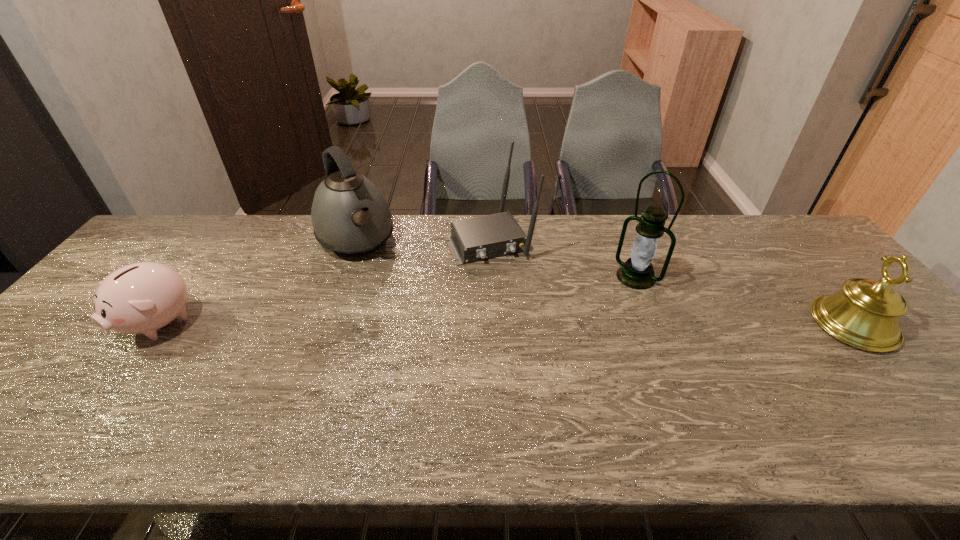
This screenshot has width=960, height=540. I want to click on vacant area between the fourth object from right to left and the router, so click(422, 241).

Locate an element on the screen. The height and width of the screenshot is (540, 960). vacant space that's between the kettle and the rightmost object is located at coordinates (604, 282).

The height and width of the screenshot is (540, 960). Find the location of `unoccupied position between the fourth object from left to right and the fourth object from right to left`. unoccupied position between the fourth object from left to right and the fourth object from right to left is located at coordinates (495, 259).

Where is `vacant area between the third object from right to left and the lantern`? The width and height of the screenshot is (960, 540). vacant area between the third object from right to left and the lantern is located at coordinates (563, 259).

You are a GUI agent. You are given a task and a screenshot of the screen. Output one action in this format:
    pyautogui.click(x=<x>, y=<y>)
    Task: Click on the empty location between the shortest object and the kettle
    
    Given the screenshot: What is the action you would take?
    pyautogui.click(x=257, y=281)

I want to click on vacant area that lies between the bell and the router, so click(x=671, y=283).

The height and width of the screenshot is (540, 960). What are the coordinates of `object that is the third nearest to the rightmost object` in the screenshot? It's located at (350, 216).

Identify which object is the closest to the second object from left to right. Please provide its 2D coordinates. Your answer should be formatted as a tuple, i.e. [(x, y)], where the tuple contains the x and y coordinates of a point satisfying the conditions above.

[(474, 239)]

Locate an element on the screen. This screenshot has width=960, height=540. free space that satisfies the following two spatial constraints: 1. on the front side of the kettle; 2. on the left side of the router is located at coordinates (355, 241).

This screenshot has width=960, height=540. Identify the location of free spot that satisfies the following two spatial constraints: 1. on the back side of the kettle; 2. on the right side of the shortest object. (221, 240).